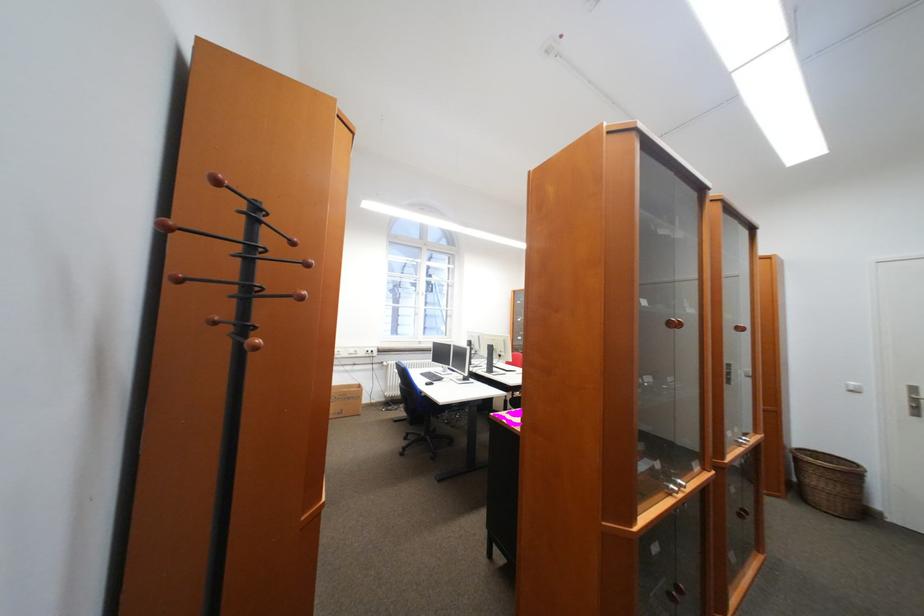
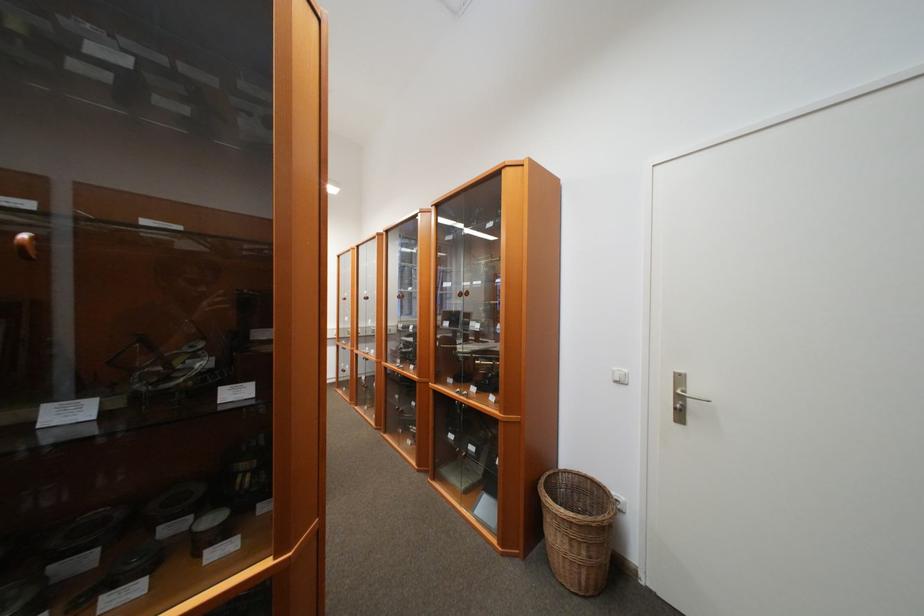
In a continuous first-person perspective shot, in which direction is the camera moving?

The cameraman moved toward right, forward.